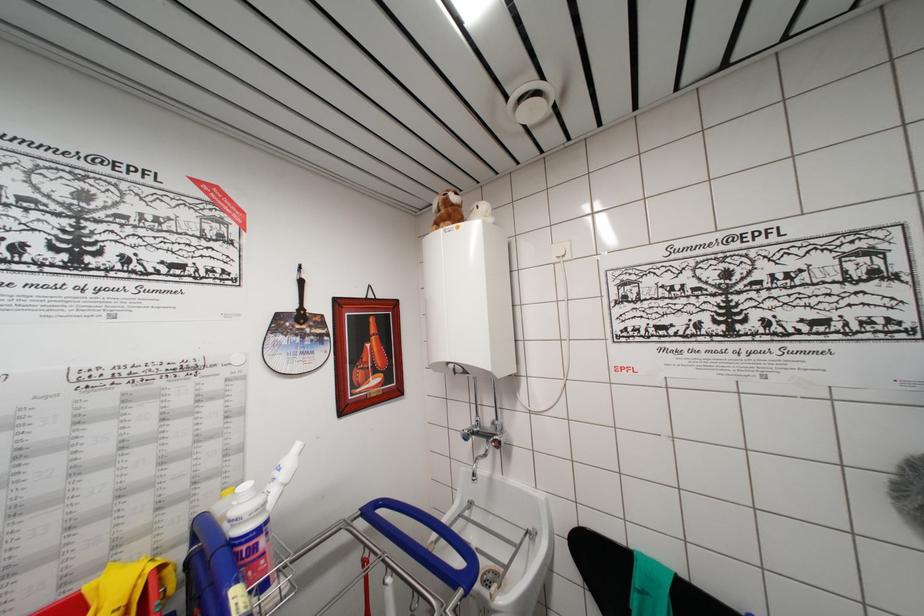
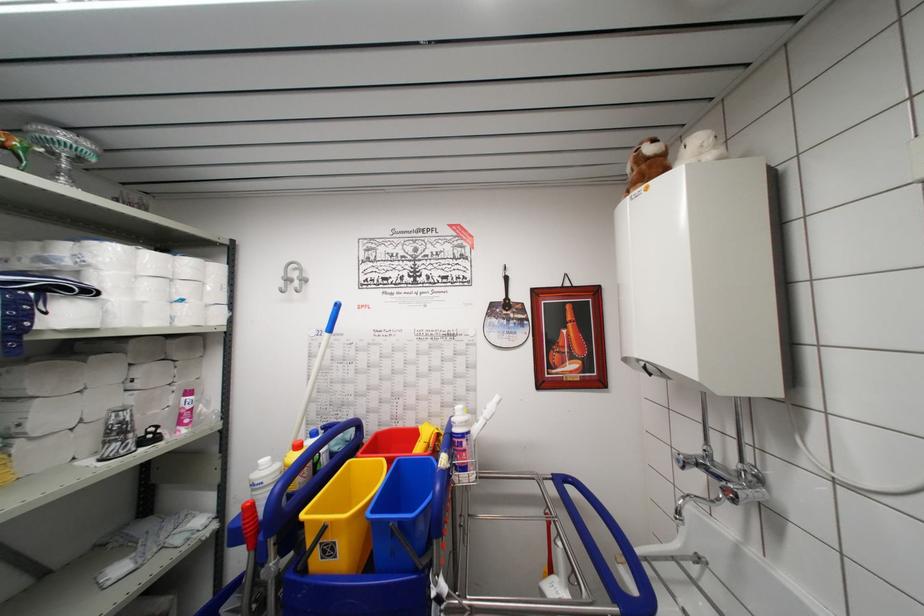
Question: I am providing you with two images of the same scene from different viewpoints. After the viewpoint changes to image2, which objects are now occluded?

Choices:
 (A) grey wall hook
 (B) white toilet paper roll
 (C) red bucket
 (D) none of these

Answer: (D)